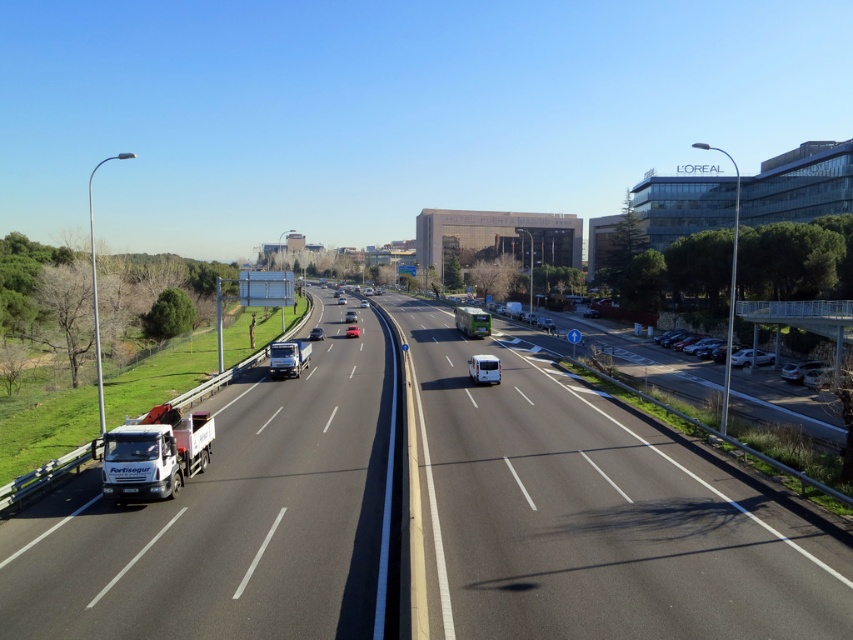
Does white matte truck at lower left have a greater width compared to shiny silver sedan at center?

Incorrect, white matte truck at lower left's width does not surpass shiny silver sedan at center's.

Which of these two, white matte truck at lower left or shiny silver sedan at center, stands taller?

With more height is shiny silver sedan at center.

Consider the image. Who is more forward, (x=113, y=465) or (x=346, y=333)?

Point (x=113, y=465) is in front.

The width and height of the screenshot is (853, 640). I want to click on white matte truck at lower left, so click(155, 454).

Is white glossy van at center shorter than satin silver sedan at right?

No.

Between point (496, 365) and point (798, 365), which one is positioned behind?

The point (798, 365) is more distant.

Locate an element on the screen. The height and width of the screenshot is (640, 853). white glossy van at center is located at coordinates [485, 369].

Can you confirm if black asphalt highway at center is taller than white matte truck at lower left?

Correct, black asphalt highway at center is much taller as white matte truck at lower left.

Describe the element at coordinates (427, 516) in the screenshot. Image resolution: width=853 pixels, height=640 pixels. I see `black asphalt highway at center` at that location.

Who is more distant from viewer, (141, 628) or (129, 499)?

Point (129, 499)

I want to click on black asphalt highway at center, so click(x=427, y=516).